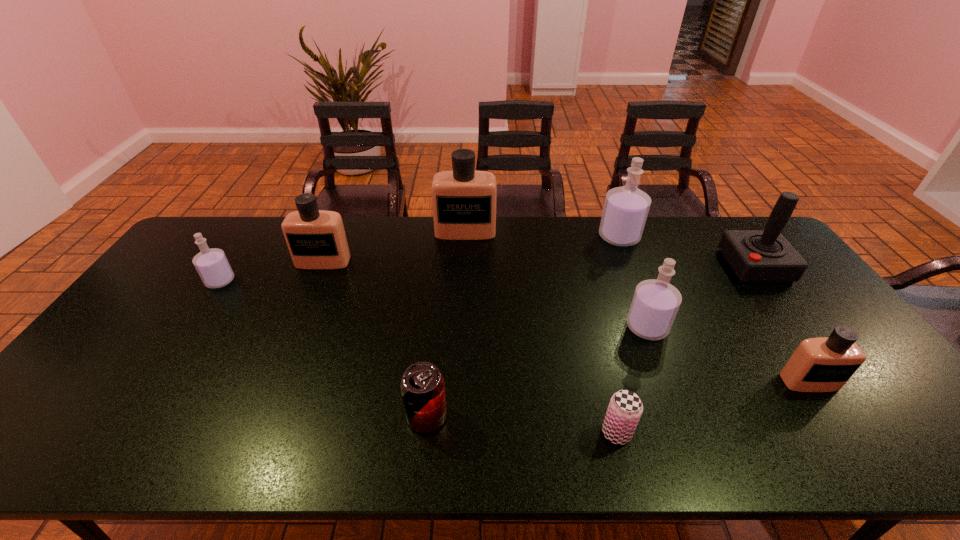
Identify the location of joystick located at the right edge. (765, 255).

You are a GUI agent. You are given a task and a screenshot of the screen. Output one action in this format:
    pyautogui.click(x=<x>, y=<y>)
    Task: Click on the perfume situated at the right edge
    This screenshot has width=960, height=540.
    Given the screenshot: What is the action you would take?
    pyautogui.click(x=824, y=364)

At what (x,y) coordinates should I click in order to perform the action: click on object positioned at the far right corner. Please return your answer as a coordinate pair (x, y). Image resolution: width=960 pixels, height=540 pixels. Looking at the image, I should click on (765, 255).

In the image, there is a desktop. Identify the location of vacant region at the far edge. (481, 247).

Where is `blank space at the near edge of the desktop`? The height and width of the screenshot is (540, 960). blank space at the near edge of the desktop is located at coordinates click(820, 460).

Identify the location of vacant region at the far right corner. The width and height of the screenshot is (960, 540). (717, 220).

The height and width of the screenshot is (540, 960). Find the location of `free region at the near right corner of the desktop`. free region at the near right corner of the desktop is located at coordinates (905, 458).

Identify the location of blank region between the biggest purple perfume and the second beige perfume from right to left. (542, 234).

The image size is (960, 540). I want to click on vacant region between the second farthest beige perfume and the fifth object from right to left, so click(x=469, y=347).

What are the coordinates of `free space between the purple beer can and the second biggest beige perfume` in the screenshot? It's located at (469, 347).